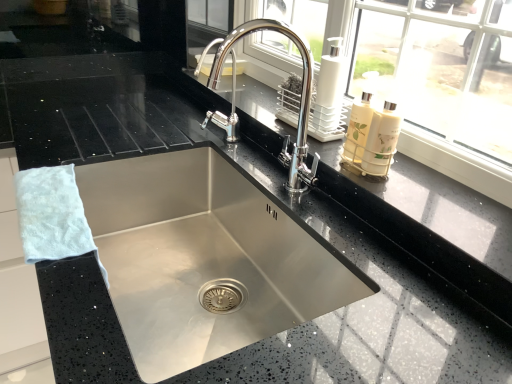
Question: Does white fluffy hand towel at left come behind polished chrome faucet at center?

Choices:
 (A) no
 (B) yes

Answer: (A)

Question: Can you confirm if white fluffy hand towel at left is smaller than polished chrome faucet at center?

Choices:
 (A) yes
 (B) no

Answer: (A)

Question: Is white fluffy hand towel at left positioned far away from polished chrome faucet at center?

Choices:
 (A) yes
 (B) no

Answer: (B)

Question: Is white fluffy hand towel at left outside polished chrome faucet at center?

Choices:
 (A) yes
 (B) no

Answer: (A)

Question: Considering the relative positions of white fluffy hand towel at left and polished chrome faucet at center in the image provided, is white fluffy hand towel at left to the right of polished chrome faucet at center from the viewer's perspective?

Choices:
 (A) no
 (B) yes

Answer: (A)

Question: Looking at their shapes, would you say polished chrome faucet at center is wider or thinner than stainless steel sink at center?

Choices:
 (A) thin
 (B) wide

Answer: (A)

Question: From a real-world perspective, is polished chrome faucet at center positioned above or below stainless steel sink at center?

Choices:
 (A) below
 (B) above

Answer: (B)

Question: In terms of size, does polished chrome faucet at center appear bigger or smaller than stainless steel sink at center?

Choices:
 (A) small
 (B) big

Answer: (A)

Question: Is polished chrome faucet at center inside or outside of stainless steel sink at center?

Choices:
 (A) outside
 (B) inside

Answer: (A)

Question: Is white fluffy hand towel at left situated inside polished chrome faucet at center or outside?

Choices:
 (A) inside
 (B) outside

Answer: (B)

Question: In terms of size, does white fluffy hand towel at left appear bigger or smaller than polished chrome faucet at center?

Choices:
 (A) small
 (B) big

Answer: (A)

Question: In the image, is white fluffy hand towel at left positioned in front of or behind polished chrome faucet at center?

Choices:
 (A) behind
 (B) front

Answer: (B)

Question: Considering the positions of point (74, 221) and point (281, 26), is point (74, 221) closer or farther from the camera than point (281, 26)?

Choices:
 (A) farther
 (B) closer

Answer: (B)

Question: From a real-world perspective, is white fluffy hand towel at left positioned above or below white glossy soap dispenser at upper right?

Choices:
 (A) above
 (B) below

Answer: (B)

Question: In terms of size, does white fluffy hand towel at left appear bigger or smaller than white glossy soap dispenser at upper right?

Choices:
 (A) big
 (B) small

Answer: (A)